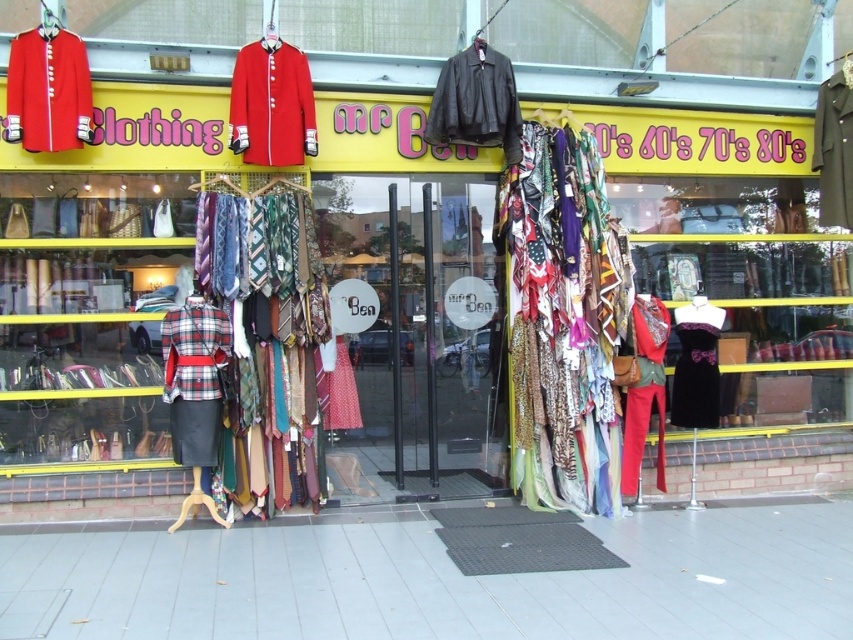
You are a customer looking at the two black garments displayed outside Mr Ben. The velvet black dress at center and the matte black jacket at upper right. Which one is located to the left of the other?

The velvet black dress at center is positioned on the left side of matte black jacket at upper right.

You are a window dresser trying to arrange the textured fabric tie at center and the matte red pants at center in a display case. Since the display case has a height limit of 1 meter, which item should you place first to ensure both fit vertically?

The textured fabric tie at center is much taller than the matte red pants at center, so you should place the textured fabric tie at center first to ensure both items fit within the 1 meter height limit.